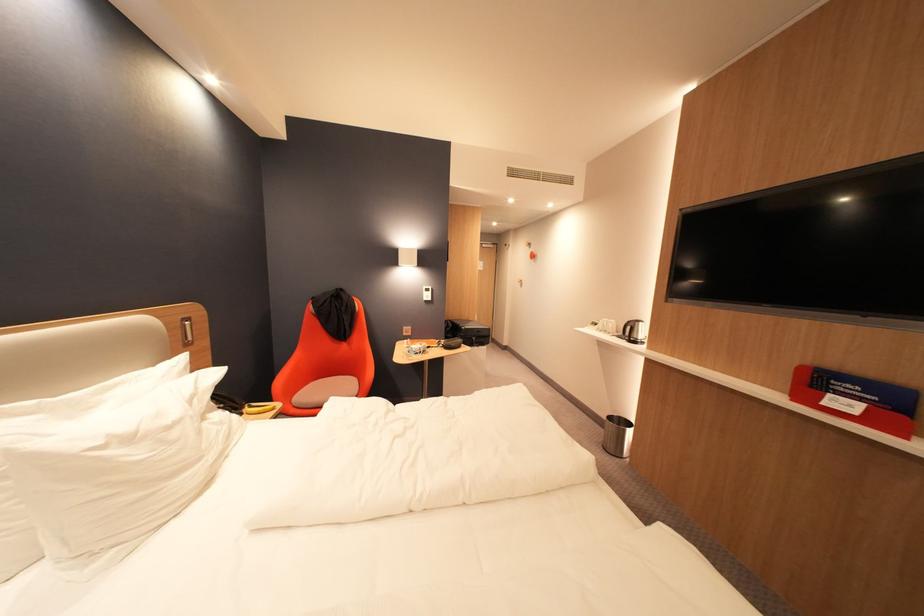
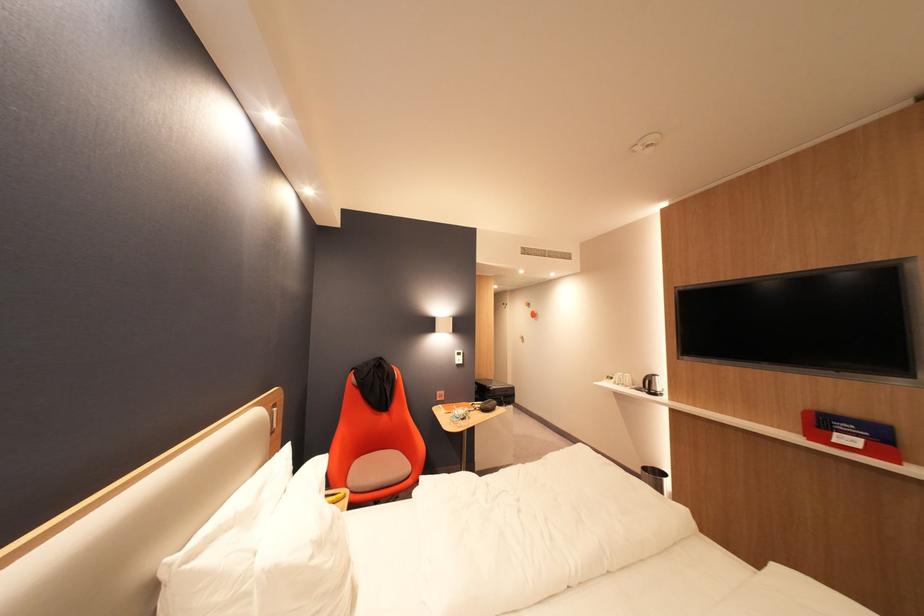
Where in the second image is the point corresponding to pixel 641 341 from the first image?

(662, 392)